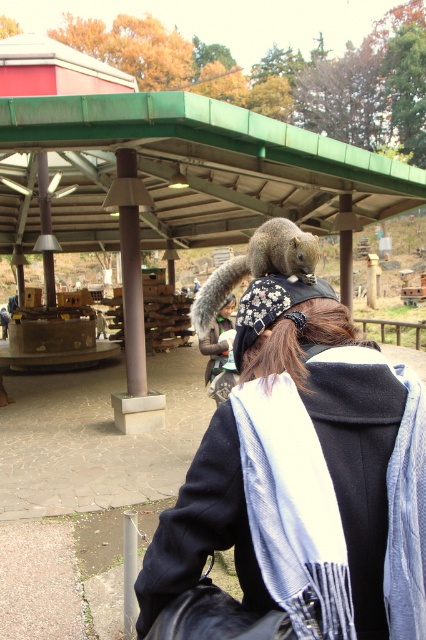
Question: Which object is farther from the camera taking this photo?

Choices:
 (A) gray furry squirrel on the shoulder
 (B) black woolen scarf at upper center

Answer: (A)

Question: Does black woolen scarf at upper center appear over gray furry squirrel on the shoulder?

Choices:
 (A) yes
 (B) no

Answer: (B)

Question: Can you confirm if black woolen scarf at upper center is positioned below gray furry squirrel on the shoulder?

Choices:
 (A) yes
 (B) no

Answer: (A)

Question: Can you confirm if black woolen scarf at upper center is positioned above gray furry squirrel on the shoulder?

Choices:
 (A) yes
 (B) no

Answer: (B)